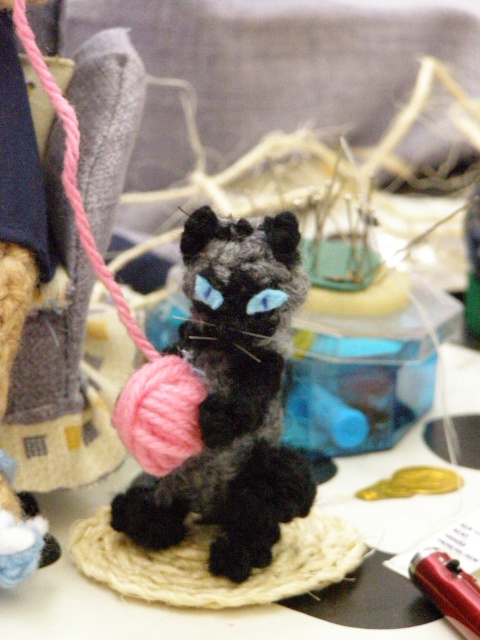
Question: Can you confirm if black yarn ball at center is bigger than red plastic pen at lower right?

Choices:
 (A) no
 (B) yes

Answer: (B)

Question: Is black yarn ball at center positioned behind red plastic pen at lower right?

Choices:
 (A) yes
 (B) no

Answer: (A)

Question: Which point is farther to the camera?

Choices:
 (A) black yarn ball at center
 (B) red plastic pen at lower right

Answer: (A)

Question: Among these points, which one is nearest to the camera?

Choices:
 (A) (298, 228)
 (B) (454, 605)

Answer: (B)

Question: Which point is closer to the camera?

Choices:
 (A) click(456, 563)
 (B) click(217, 232)

Answer: (B)

Question: Does black yarn ball at center appear on the right side of red plastic pen at lower right?

Choices:
 (A) yes
 (B) no

Answer: (B)